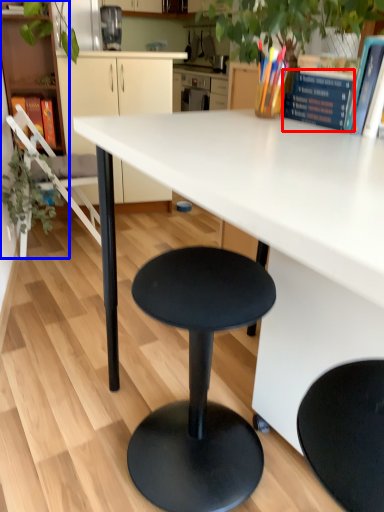
Question: Which of the following is the farthest to the observer, book (highlighted by a red box) or bookshelf (highlighted by a blue box)?

Choices:
 (A) book
 (B) bookshelf

Answer: (B)